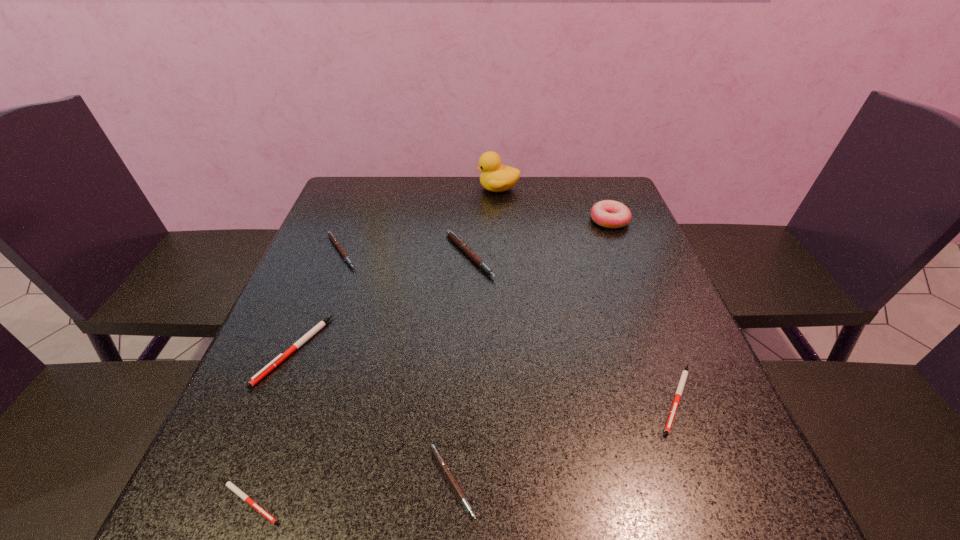
I want to click on the second smallest white pen, so click(x=678, y=394).

The width and height of the screenshot is (960, 540). In order to click on the nearest white pen in this screenshot , I will do `click(230, 485)`.

Identify the location of the shortest object. (230, 485).

At what (x,y) coordinates should I click in order to perform the action: click on blank space located 0.180m on the front-facing side of the tallest object. Please return your answer as a coordinate pair (x, y). The image size is (960, 540). Looking at the image, I should click on (420, 188).

Find the location of a particular element. vacant space located on the front-facing side of the tallest object is located at coordinates (404, 188).

What are the coordinates of `free space located on the front-facing side of the tallest object` in the screenshot? It's located at (410, 188).

Where is `vacant space situated on the front of the second farthest object`? This screenshot has width=960, height=540. vacant space situated on the front of the second farthest object is located at coordinates (633, 279).

At what (x,y) coordinates should I click in order to perform the action: click on vacant region located 0.060m at the nib of the biggest pink pen. Please return your answer as a coordinate pair (x, y). The width and height of the screenshot is (960, 540). Looking at the image, I should click on (517, 256).

You are a GUI agent. You are given a task and a screenshot of the screen. Output one action in this format:
    pyautogui.click(x=<x>, y=<y>)
    Task: Click on the vacant space located 0.220m at the nib of the second biggest pink pen
    Image resolution: width=960 pixels, height=540 pixels.
    Given the screenshot: What is the action you would take?
    pyautogui.click(x=445, y=252)

Image resolution: width=960 pixels, height=540 pixels. What are the coordinates of `free location located on the clicker of the biggest white pen` in the screenshot? It's located at (249, 463).